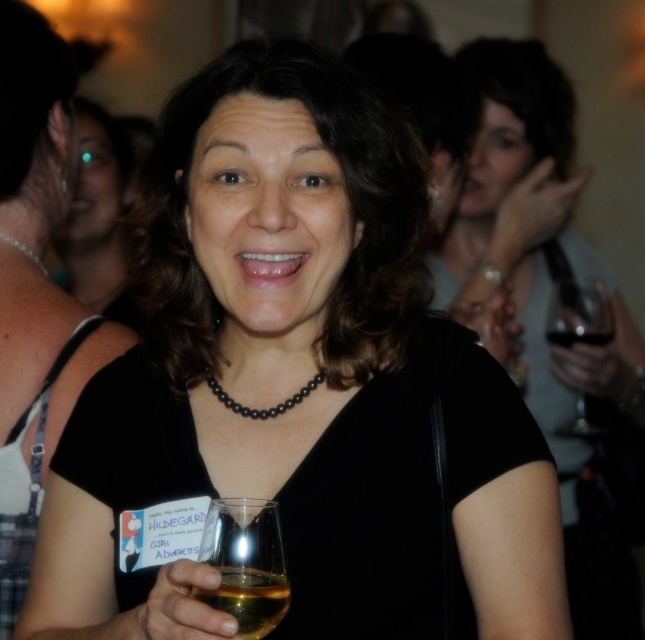
Question: Does matte black necklace at center have a smaller size compared to clear glass wine at center?

Choices:
 (A) no
 (B) yes

Answer: (A)

Question: Which point is closer to the camera?

Choices:
 (A) (258, 556)
 (B) (43, 273)
 (C) (481, 237)

Answer: (A)

Question: Which point is closer to the camera taking this photo?

Choices:
 (A) coord(117,243)
 (B) coord(6,12)
 (C) coord(557,106)

Answer: (B)

Question: Is clear glass wine glass at lower center to the left of black pearl necklace at upper left from the viewer's perspective?

Choices:
 (A) yes
 (B) no

Answer: (B)

Question: Can you confirm if black beaded necklace at center is wider than clear glass wine at center?

Choices:
 (A) no
 (B) yes

Answer: (B)

Question: Which point is closer to the camera?

Choices:
 (A) matte black dress at center
 (B) matte black necklace at center

Answer: (A)